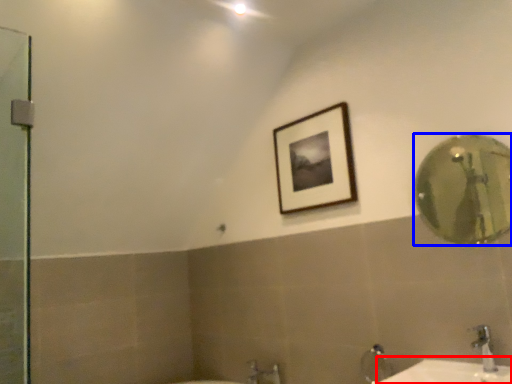
Question: Which object appears farthest to the camera in this image, counter top (highlighted by a red box) or mirror (highlighted by a blue box)?

Choices:
 (A) counter top
 (B) mirror

Answer: (B)